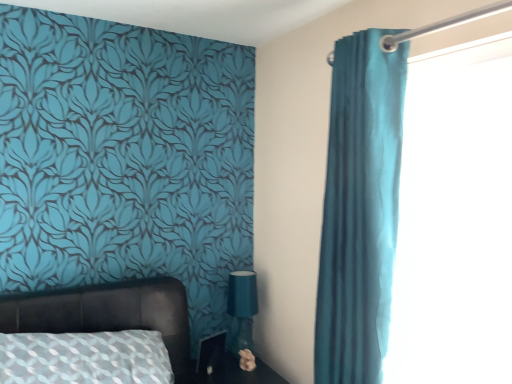
Where is `vacant space situated on the left part of fluffy beige flower at lower center`? The width and height of the screenshot is (512, 384). vacant space situated on the left part of fluffy beige flower at lower center is located at coordinates (221, 372).